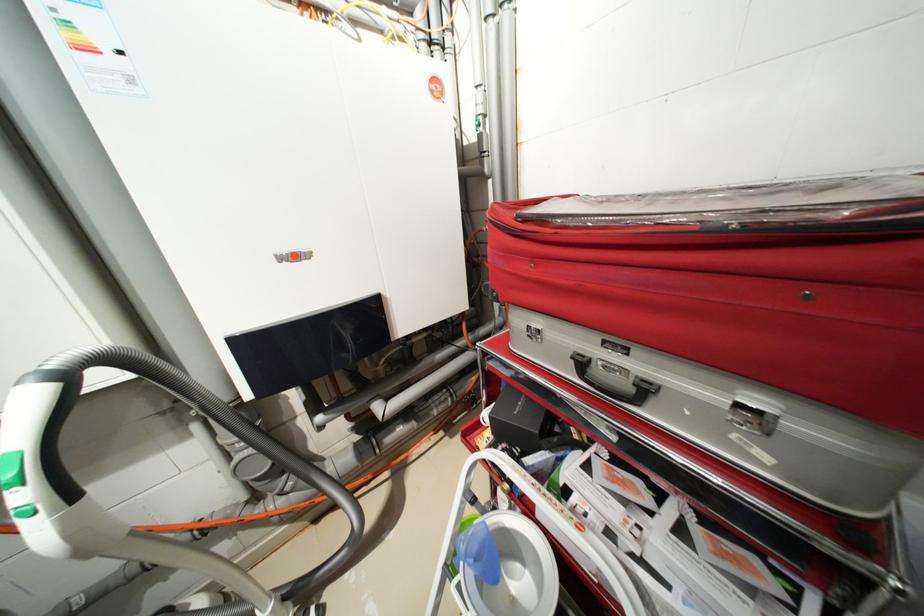
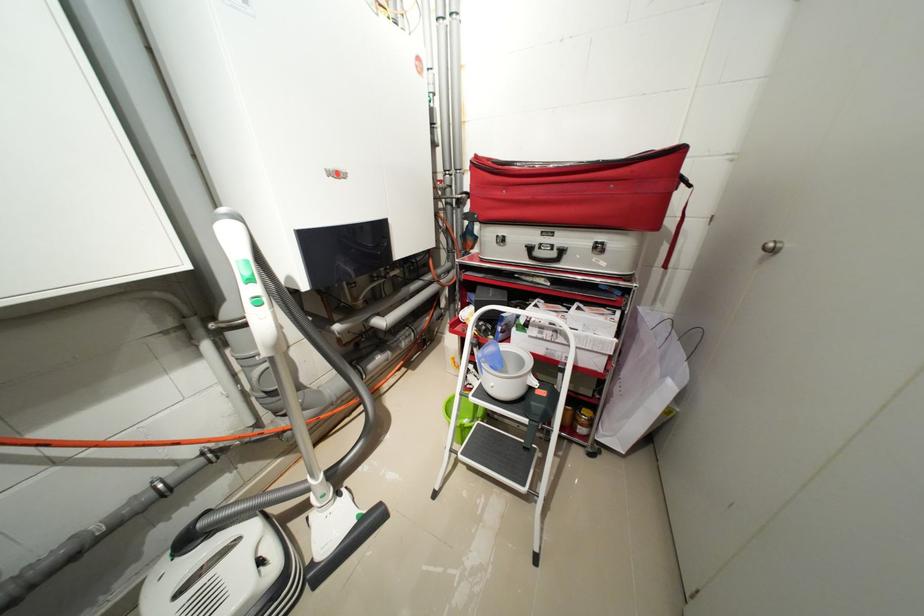
Question: How did the camera likely rotate?

Choices:
 (A) Left
 (B) Right
 (C) Up
 (D) Down

Answer: (B)